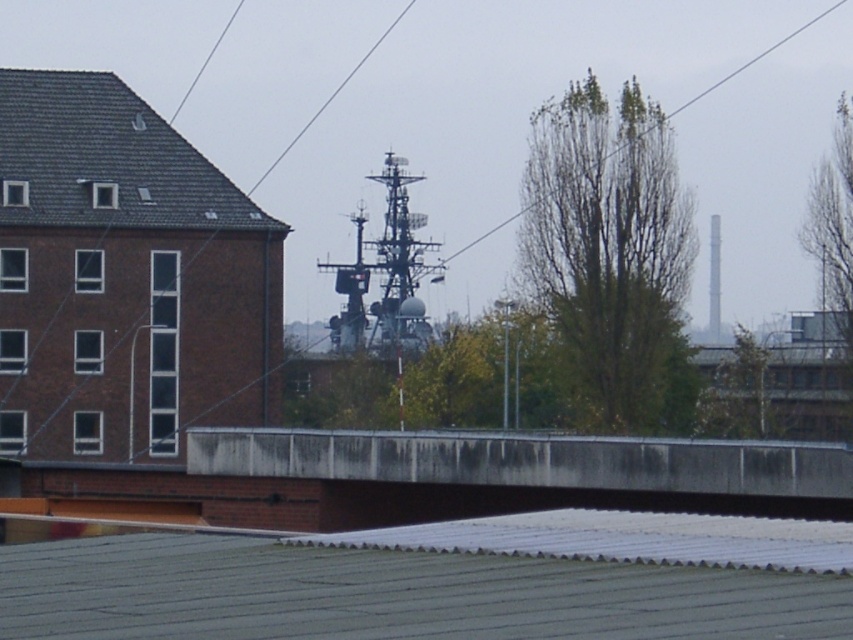
Is transparent wire at upper center taller than metallic wire at upper center?

Yes.

Can you confirm if transparent wire at upper center is positioned above metallic wire at upper center?

No, transparent wire at upper center is not above metallic wire at upper center.

I want to click on transparent wire at upper center, so click(x=755, y=58).

Does metallic gray ship at center appear over transparent wire at upper center?

No, metallic gray ship at center is not above transparent wire at upper center.

Can you confirm if metallic gray ship at center is positioned to the left of transparent wire at upper center?

Indeed, metallic gray ship at center is positioned on the left side of transparent wire at upper center.

The image size is (853, 640). What do you see at coordinates (386, 275) in the screenshot?
I see `metallic gray ship at center` at bounding box center [386, 275].

You are a GUI agent. You are given a task and a screenshot of the screen. Output one action in this format:
    pyautogui.click(x=<x>, y=<y>)
    Task: Click on the metallic gray ship at center
    
    Given the screenshot: What is the action you would take?
    pyautogui.click(x=386, y=275)

Which is below, green corrugated metal roof at lower center or metallic gray ship at center?

green corrugated metal roof at lower center is below.

Is point (387, 534) positioned after point (410, 292)?

No.

At what (x,y) coordinates should I click in order to perform the action: click on green corrugated metal roof at lower center. Please return your answer as a coordinate pair (x, y). This screenshot has width=853, height=640. Looking at the image, I should click on (437, 580).